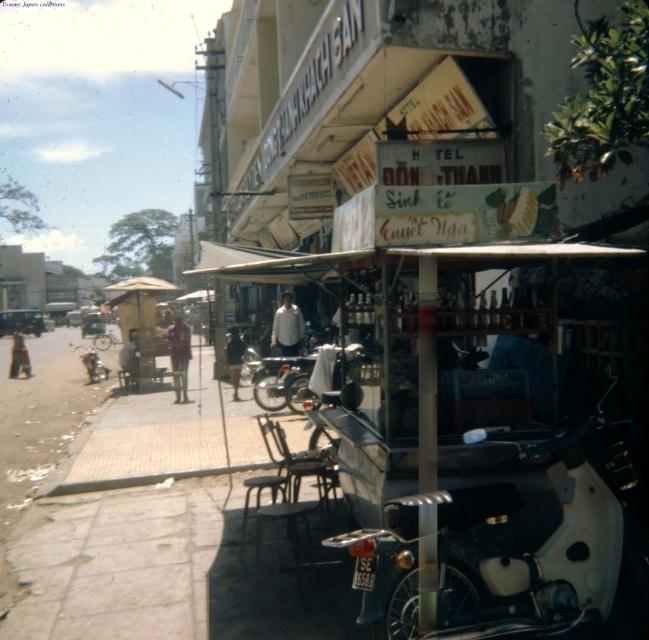
Question: Which of the following is the closest to the observer?

Choices:
 (A) (282, 339)
 (B) (21, 330)
 (C) (456, 595)
 (D) (234, 385)

Answer: (C)

Question: Considering the relative positions of white matte motorcycle at center and dark brown leather jacket at center in the image provided, where is white matte motorcycle at center located with respect to dark brown leather jacket at center?

Choices:
 (A) left
 (B) right

Answer: (B)

Question: Can you confirm if white matte motorcycle at center is positioned to the left of purple fabric shirt at center?

Choices:
 (A) no
 (B) yes

Answer: (A)

Question: Does white matte motorcycle at center have a smaller size compared to white matte shirt at center?

Choices:
 (A) no
 (B) yes

Answer: (A)

Question: Which object is closer to the camera taking this photo?

Choices:
 (A) white matte shirt at center
 (B) dark brown leather jacket at center
 (C) purple fabric shirt at center
 (D) dark blue shirt at center

Answer: (A)

Question: Which point is farther from the camera taking this photo?

Choices:
 (A) (471, 460)
 (B) (129, 371)
 (C) (238, 356)
 (D) (284, 310)

Answer: (B)